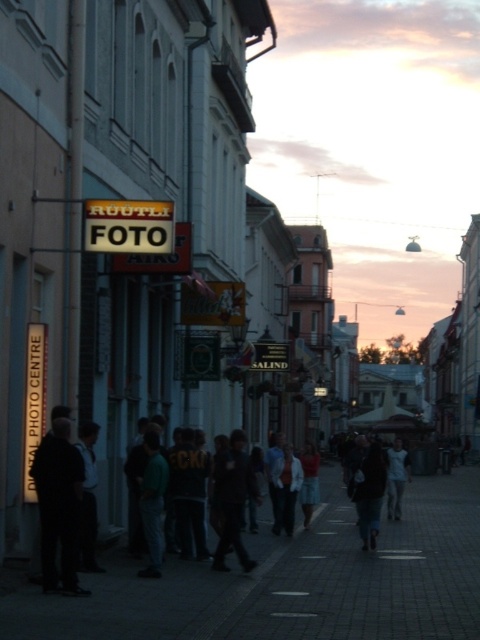
Consider the image. Does pastel pink sky at upper center appear over dark gray concrete sidewalk at center?

Indeed, pastel pink sky at upper center is positioned over dark gray concrete sidewalk at center.

Is point (360, 49) positioned after point (356, 616)?

Yes, it is.

Does point (428, 193) lie in front of point (302, 602)?

No, (428, 193) is behind (302, 602).

This screenshot has width=480, height=640. Identify the location of pastel pink sky at upper center. (374, 145).

Can you confirm if dark gray concrete sidewalk at center is bigger than light blue fabric dress at center?

Indeed, dark gray concrete sidewalk at center has a larger size compared to light blue fabric dress at center.

Can you confirm if dark gray concrete sidewalk at center is positioned to the left of light blue fabric dress at center?

Incorrect, dark gray concrete sidewalk at center is not on the left side of light blue fabric dress at center.

Does point (475, 484) come farther from viewer compared to point (404, 490)?

Yes.

This screenshot has height=640, width=480. I want to click on dark gray concrete sidewalk at center, so click(371, 573).

Who is taller, pastel pink sky at upper center or dark fabric pants at left?

With more height is pastel pink sky at upper center.

Can you confirm if pastel pink sky at upper center is wider than dark fabric pants at left?

Yes, pastel pink sky at upper center is wider than dark fabric pants at left.

Is point (465, 116) behind point (71, 474)?

Yes, point (465, 116) is farther from viewer.

This screenshot has height=640, width=480. I want to click on pastel pink sky at upper center, so click(374, 145).